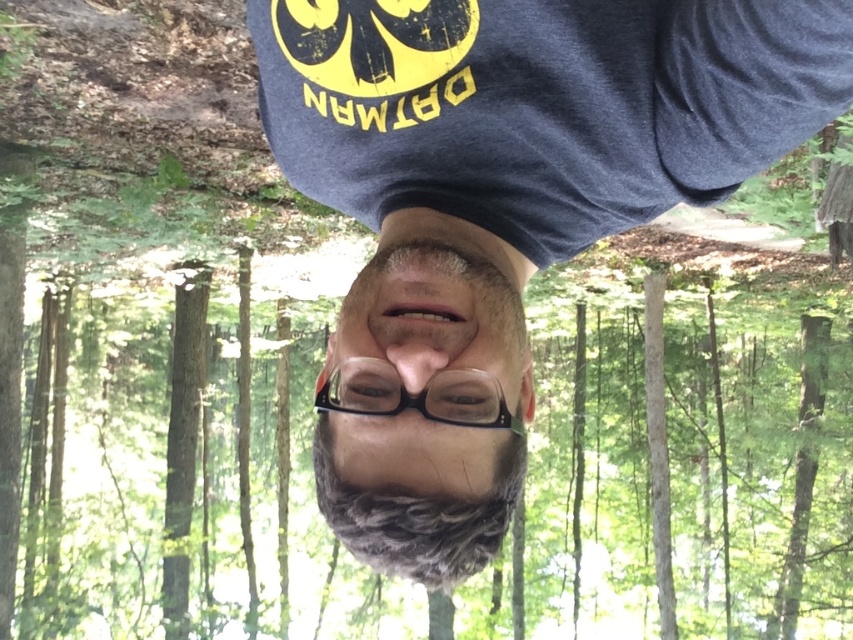
Measure the distance between dark blue t-shirt at center and gray matte hair at center.

The distance of dark blue t-shirt at center from gray matte hair at center is 3.65 inches.

Between dark blue t-shirt at center and gray matte hair at center, which one appears on the right side from the viewer's perspective?

dark blue t-shirt at center is more to the right.

Which is behind, point (491, 436) or point (405, 484)?

Positioned behind is point (491, 436).

This screenshot has height=640, width=853. What are the coordinates of `dark blue t-shirt at center` in the screenshot? It's located at (502, 209).